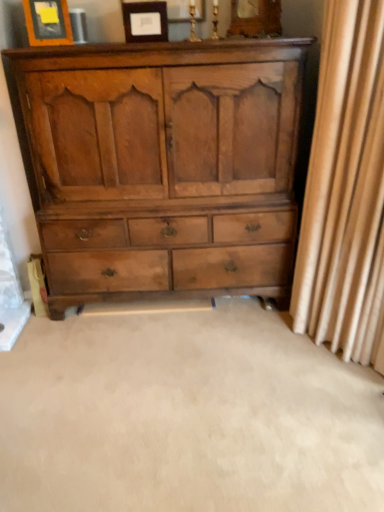
Question: Considering the relative sizes of matte wood picture frame at upper center, which is the 2th picture frame in left-to-right order, and beige fabric curtain at right in the image provided, is matte wood picture frame at upper center, which is the 2th picture frame in left-to-right order, wider than beige fabric curtain at right?

Choices:
 (A) no
 (B) yes

Answer: (A)

Question: Would you consider matte wood picture frame at upper center, which is the 2th picture frame in left-to-right order, to be distant from beige fabric curtain at right?

Choices:
 (A) yes
 (B) no

Answer: (A)

Question: Considering the relative sizes of matte wood picture frame at upper center, which is the 2th picture frame in left-to-right order, and beige fabric curtain at right in the image provided, is matte wood picture frame at upper center, which is the 2th picture frame in left-to-right order, taller than beige fabric curtain at right?

Choices:
 (A) yes
 (B) no

Answer: (B)

Question: Can you see matte wood picture frame at upper center, placed as the 1th picture frame when sorted from right to left, touching beige fabric curtain at right?

Choices:
 (A) yes
 (B) no

Answer: (B)

Question: Is matte wood picture frame at upper center, which is the 2th picture frame in left-to-right order, looking in the opposite direction of beige fabric curtain at right?

Choices:
 (A) no
 (B) yes

Answer: (A)

Question: Visually, is light brown wood chest of drawers at center positioned to the left or to the right of matte wood picture frame at upper center, which is the 2th picture frame in left-to-right order?

Choices:
 (A) right
 (B) left

Answer: (A)

Question: In the image, is light brown wood chest of drawers at center positioned in front of or behind matte wood picture frame at upper center, placed as the 1th picture frame when sorted from right to left?

Choices:
 (A) front
 (B) behind

Answer: (A)

Question: Considering the positions of light brown wood chest of drawers at center and matte wood picture frame at upper center, which is the 2th picture frame in left-to-right order, in the image, is light brown wood chest of drawers at center bigger or smaller than matte wood picture frame at upper center, which is the 2th picture frame in left-to-right order,?

Choices:
 (A) small
 (B) big

Answer: (B)

Question: Does point (130, 214) appear closer or farther from the camera than point (155, 19)?

Choices:
 (A) farther
 (B) closer

Answer: (A)

Question: Based on their sizes in the image, would you say matte wood picture frame at upper left, the first picture frame viewed from the left, is bigger or smaller than light brown wood chest of drawers at center?

Choices:
 (A) small
 (B) big

Answer: (A)

Question: Considering the positions of point (57, 1) and point (61, 226), is point (57, 1) closer or farther from the camera than point (61, 226)?

Choices:
 (A) closer
 (B) farther

Answer: (A)

Question: From the image's perspective, is matte wood picture frame at upper left, the first picture frame viewed from the left, located above or below light brown wood chest of drawers at center?

Choices:
 (A) below
 (B) above

Answer: (B)

Question: Based on their positions, is matte wood picture frame at upper left, the first picture frame viewed from the left, located to the left or right of light brown wood chest of drawers at center?

Choices:
 (A) left
 (B) right

Answer: (A)

Question: From a real-world perspective, is beige fabric curtain at right above or below light brown wood chest of drawers at center?

Choices:
 (A) above
 (B) below

Answer: (A)

Question: In the image, is beige fabric curtain at right positioned in front of or behind light brown wood chest of drawers at center?

Choices:
 (A) front
 (B) behind

Answer: (A)